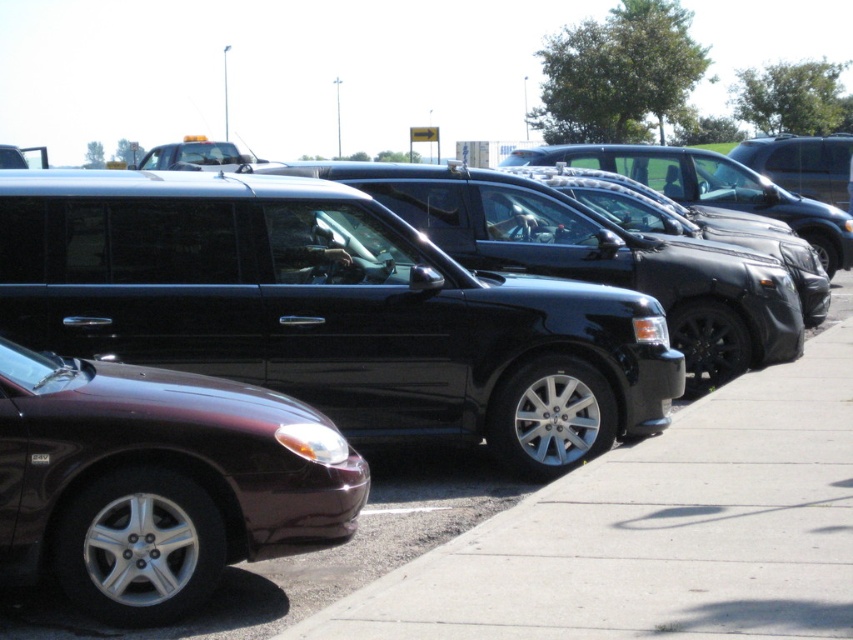
Which of these two, shiny maroon sedan at lower left or black asphalt pavement at center, stands taller?

shiny maroon sedan at lower left

Consider the image. Can you confirm if shiny maroon sedan at lower left is thinner than black asphalt pavement at center?

Yes.

Identify the location of shiny maroon sedan at lower left. (158, 481).

Locate an element on the screen. This screenshot has width=853, height=640. shiny maroon sedan at lower left is located at coordinates (158, 481).